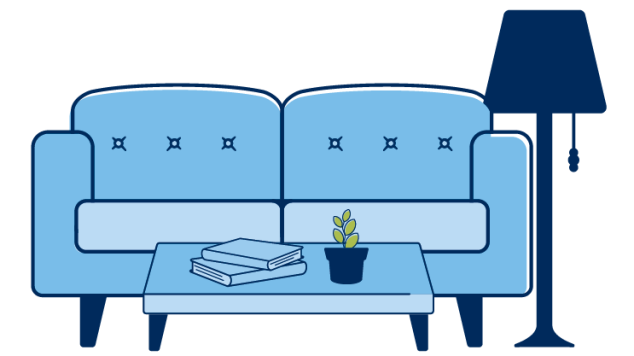
Image resolution: width=634 pixels, height=356 pixels. Identify the location of books. (264, 267).